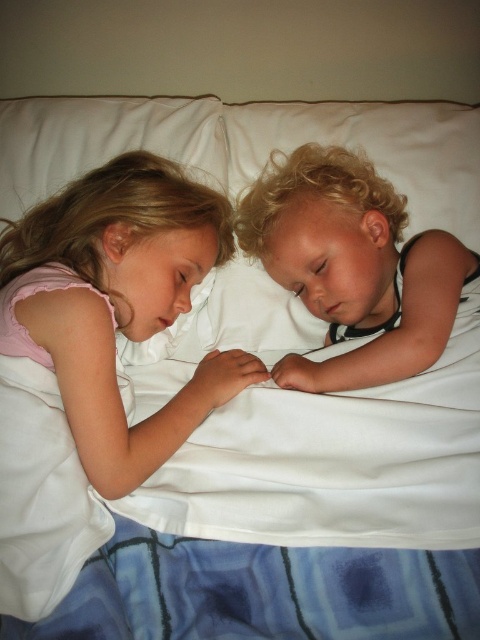
Can you confirm if pink fabric dress at center is positioned to the left of smooth black shirt at right?

Indeed, pink fabric dress at center is positioned on the left side of smooth black shirt at right.

Between pink fabric dress at center and smooth black shirt at right, which one appears on the left side from the viewer's perspective?

From the viewer's perspective, pink fabric dress at center appears more on the left side.

Locate an element on the screen. pink fabric dress at center is located at coordinates (118, 305).